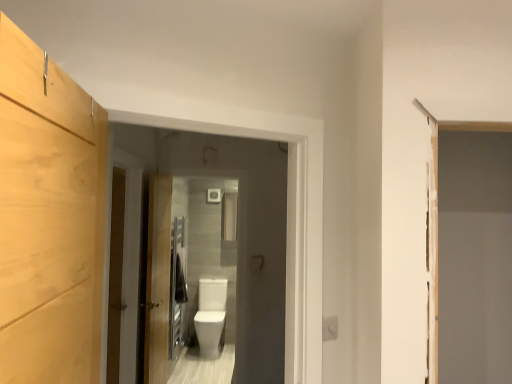
Question: Would you say wooden door at center, arranged as the first door when viewed from the back, is outside wooden door at center, placed as the first door when sorted from left to right?

Choices:
 (A) yes
 (B) no

Answer: (A)

Question: Is wooden door at center, which is counted as the second door, starting from the front, in contact with wooden door at center, acting as the 1th door starting from the front?

Choices:
 (A) yes
 (B) no

Answer: (B)

Question: Can you confirm if wooden door at center, arranged as the first door when viewed from the back, is shorter than wooden door at center, acting as the second door starting from the right?

Choices:
 (A) yes
 (B) no

Answer: (B)

Question: Can you confirm if wooden door at center, the first door positioned from the right, is taller than wooden door at center, placed as the first door when sorted from left to right?

Choices:
 (A) yes
 (B) no

Answer: (A)

Question: From a real-world perspective, is wooden door at center, the first door positioned from the right, below wooden door at center, acting as the 1th door starting from the front?

Choices:
 (A) yes
 (B) no

Answer: (A)

Question: Do you think white glossy toilet at center is within wooden barn door at left, or outside of it?

Choices:
 (A) inside
 (B) outside

Answer: (B)

Question: Does point (272, 336) appear closer or farther from the camera than point (120, 253)?

Choices:
 (A) closer
 (B) farther

Answer: (B)

Question: In the image, is white glossy toilet at center positioned in front of or behind wooden barn door at left?

Choices:
 (A) front
 (B) behind

Answer: (A)

Question: Based on their positions, is white glossy toilet at center located to the left or right of wooden barn door at left?

Choices:
 (A) left
 (B) right

Answer: (B)

Question: From a real-world perspective, is wooden barn door at left positioned above or below wooden door at center, which appears as the second door when viewed from the back?

Choices:
 (A) above
 (B) below

Answer: (B)

Question: Is point (115, 258) positioned closer to the camera than point (137, 238)?

Choices:
 (A) farther
 (B) closer

Answer: (B)

Question: In terms of size, does wooden barn door at left appear bigger or smaller than wooden door at center, acting as the 1th door starting from the front?

Choices:
 (A) small
 (B) big

Answer: (A)

Question: Is wooden barn door at left taller or shorter than wooden door at center, placed as the first door when sorted from left to right?

Choices:
 (A) short
 (B) tall

Answer: (A)

Question: From a real-world perspective, relative to wooden barn door at left, is wooden door at center, which appears as the second door when viewed from the back, vertically above or below?

Choices:
 (A) above
 (B) below

Answer: (A)

Question: Is wooden door at center, placed as the first door when sorted from left to right, inside or outside of wooden barn door at left?

Choices:
 (A) outside
 (B) inside

Answer: (A)